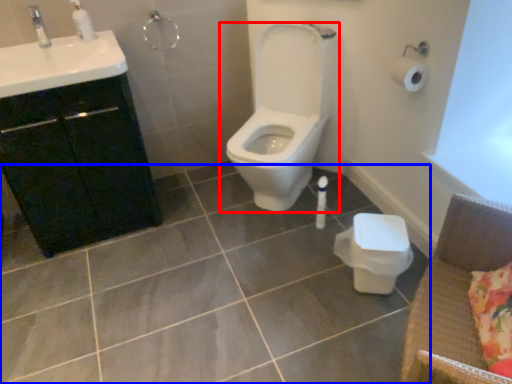
Question: Which of the following is the farthest to the observer, toilet (highlighted by a red box) or ceramic tile (highlighted by a blue box)?

Choices:
 (A) toilet
 (B) ceramic tile

Answer: (A)